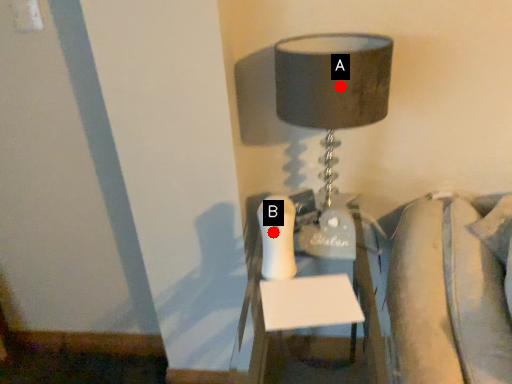
Question: Two points are circled on the image, labeled by A and B beside each circle. Among these points, which one is nearest to the camera?

Choices:
 (A) A is closer
 (B) B is closer

Answer: (A)